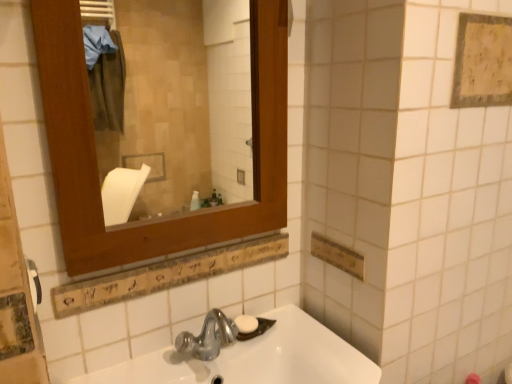
Question: Is wooden frame at upper left smaller than yellowish textured fabric at upper right?

Choices:
 (A) yes
 (B) no

Answer: (B)

Question: Considering the relative sizes of wooden frame at upper left and yellowish textured fabric at upper right in the image provided, is wooden frame at upper left thinner than yellowish textured fabric at upper right?

Choices:
 (A) yes
 (B) no

Answer: (B)

Question: From the image's perspective, is wooden frame at upper left located beneath yellowish textured fabric at upper right?

Choices:
 (A) yes
 (B) no

Answer: (A)

Question: Is wooden frame at upper left further to camera compared to yellowish textured fabric at upper right?

Choices:
 (A) yes
 (B) no

Answer: (B)

Question: Can you confirm if wooden frame at upper left is taller than yellowish textured fabric at upper right?

Choices:
 (A) yes
 (B) no

Answer: (A)

Question: Does wooden frame at upper left contain yellowish textured fabric at upper right?

Choices:
 (A) yes
 (B) no

Answer: (B)

Question: Is yellowish textured fabric at upper right closer to the viewer compared to white matte soap at center?

Choices:
 (A) yes
 (B) no

Answer: (A)

Question: From a real-world perspective, is yellowish textured fabric at upper right below white matte soap at center?

Choices:
 (A) no
 (B) yes

Answer: (A)

Question: Is yellowish textured fabric at upper right directly adjacent to white matte soap at center?

Choices:
 (A) yes
 (B) no

Answer: (B)

Question: From a real-world perspective, is yellowish textured fabric at upper right physically above white matte soap at center?

Choices:
 (A) yes
 (B) no

Answer: (A)

Question: Considering the relative sizes of yellowish textured fabric at upper right and white matte soap at center in the image provided, is yellowish textured fabric at upper right thinner than white matte soap at center?

Choices:
 (A) no
 (B) yes

Answer: (B)

Question: Is yellowish textured fabric at upper right positioned beyond the bounds of white matte soap at center?

Choices:
 (A) no
 (B) yes

Answer: (B)

Question: Does white plastic towel bar at left have a larger size compared to yellowish textured fabric at upper right?

Choices:
 (A) yes
 (B) no

Answer: (B)